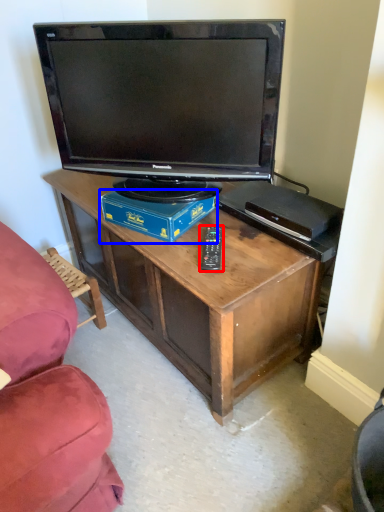
Question: Which object appears closest to the camera in this image, remote (highlighted by a red box) or box (highlighted by a blue box)?

Choices:
 (A) remote
 (B) box

Answer: (A)